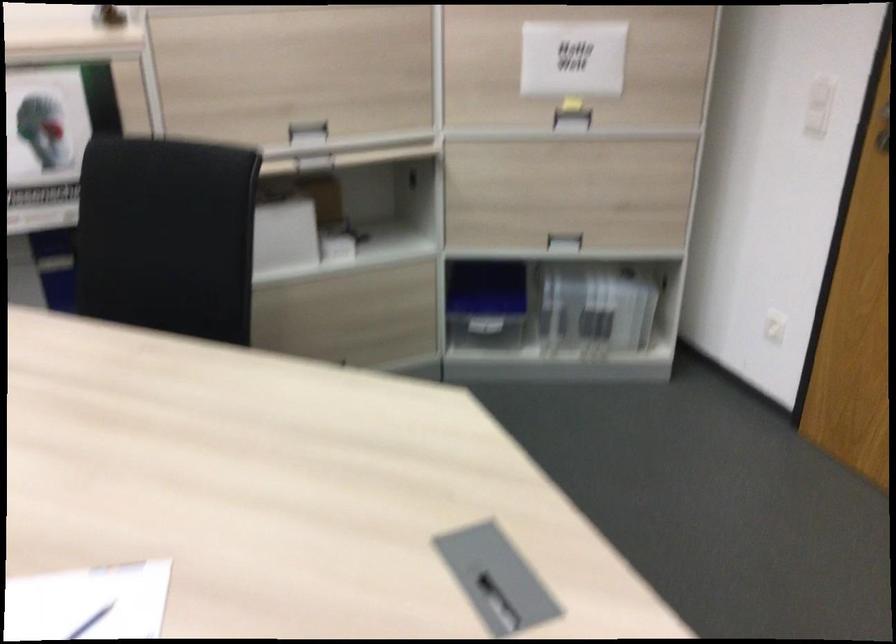
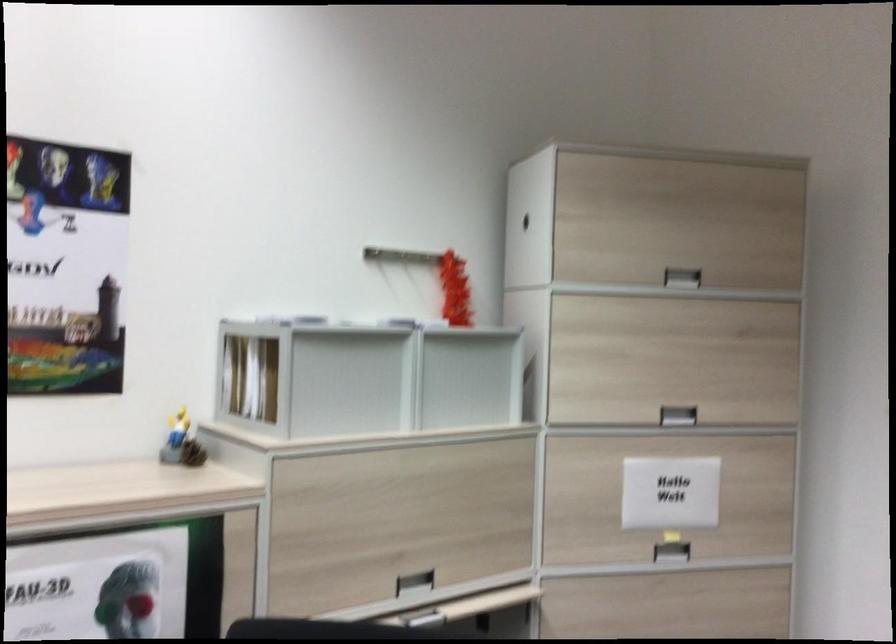
Question: Based on the continuous images, in which direction is the camera rotating? Reply with the corresponding letter.

Choices:
 (A) Left
 (B) Right
 (C) Up
 (D) Down

Answer: (C)